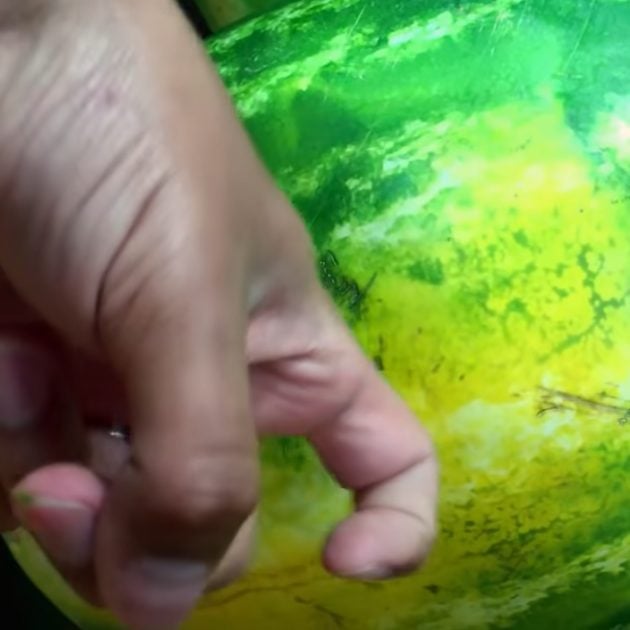
Locate an element on the screen. floor is located at coordinates (23, 600).